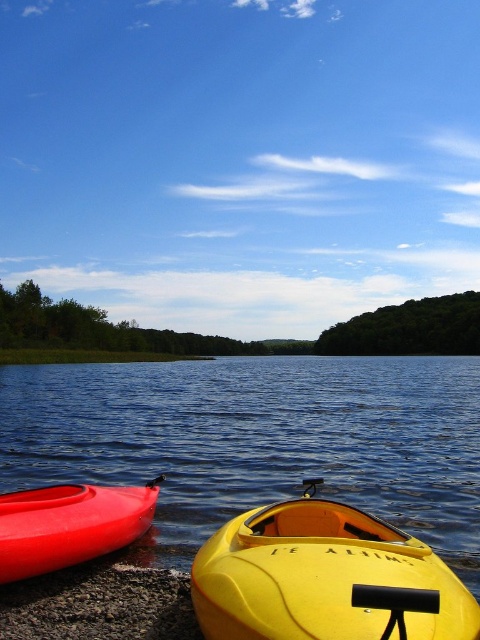
Which of these two, blue glossy water at lower left or matte red canoe at lower left, stands taller?

With more height is blue glossy water at lower left.

Which is behind, point (69, 364) or point (91, 500)?

The point (69, 364) is more distant.

You are a GUI agent. You are given a task and a screenshot of the screen. Output one action in this format:
    pyautogui.click(x=<x>, y=<y>)
    Task: Click on the blue glossy water at lower left
    Image resolution: width=480 pixels, height=640 pixels.
    Given the screenshot: What is the action you would take?
    pyautogui.click(x=257, y=440)

Consider the image. Which is more to the right, yellow matte kayak at lower center or matte red canoe at lower left?

Positioned to the right is yellow matte kayak at lower center.

Does yellow matte kayak at lower center have a greater width compared to matte red canoe at lower left?

In fact, yellow matte kayak at lower center might be narrower than matte red canoe at lower left.

Does point (363, 529) come closer to viewer compared to point (118, 499)?

Yes, point (363, 529) is closer to viewer.

Where is `yellow matte kayak at lower center`? The height and width of the screenshot is (640, 480). yellow matte kayak at lower center is located at coordinates (324, 579).

Can you confirm if blue glossy water at lower left is thinner than yellow matte kayak at lower center?

In fact, blue glossy water at lower left might be wider than yellow matte kayak at lower center.

The width and height of the screenshot is (480, 640). Describe the element at coordinates (257, 440) in the screenshot. I see `blue glossy water at lower left` at that location.

Image resolution: width=480 pixels, height=640 pixels. Identify the location of blue glossy water at lower left. (257, 440).